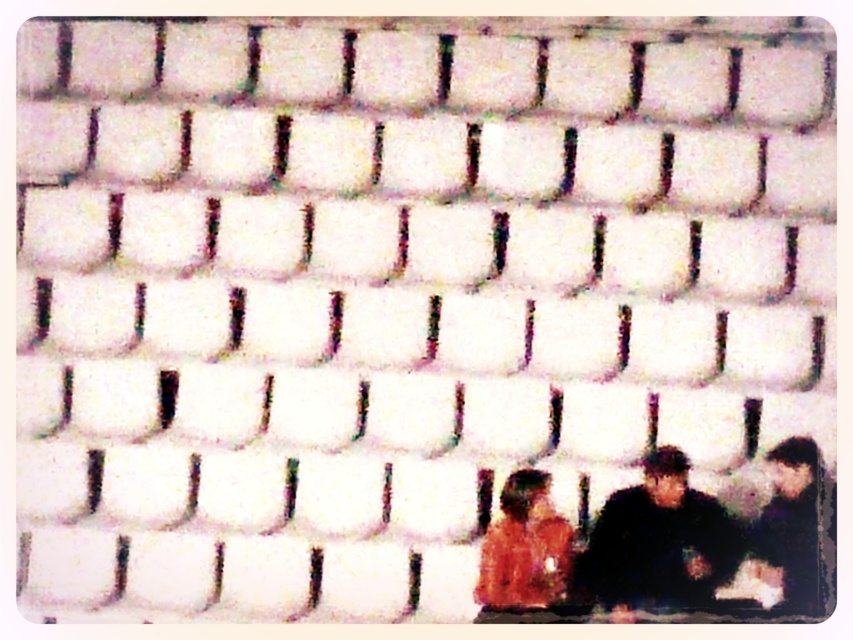
You are an interior designer assessing a pixelated image of a seating area. You notice the orange fabric couple at lower right and the orange fabric shirt at lower right. Which object occupies more horizontal space in the image?

The orange fabric couple at lower right has a greater width than the orange fabric shirt at lower right, so the orange fabric couple at lower right occupies more horizontal space.

You are a fashion designer observing the image and want to create a new outfit that combines elements from both the dark gray fabric jacket at lower right and the orange fabric shirt at lower right. Which piece should you place on top to ensure the combination follows the layering seen in the image?

The dark gray fabric jacket at lower right is positioned on the right side of orange fabric shirt at lower right, so to follow the layering seen in the image, you should place the dark gray fabric jacket at lower right on top of the orange fabric shirt at lower right.

You are an interior designer assessing a pixelated image of a seating area. The scene shows three figures seated against a grainy background. The orange fabric couple at lower right and dark gray fabric jacket at lower right are both visible. Based on the image, which object might have a greater width?

The orange fabric couple at lower right might be wider than dark gray fabric jacket at lower right according to the description.